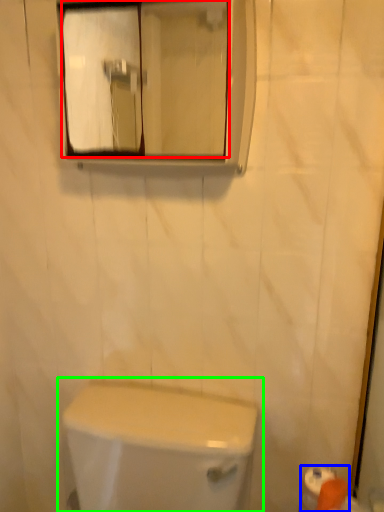
Question: Considering the real-world distances, which object is farthest from mirror (highlighted by a red box)? toilet paper (highlighted by a blue box) or toilet (highlighted by a green box)?

Choices:
 (A) toilet paper
 (B) toilet

Answer: (A)